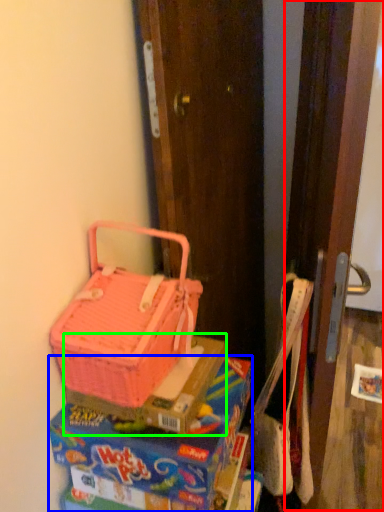
Question: Which object is positioned closest to screen door (highlighted by a red box)? Select from lunch box (highlighted by a blue box) and box (highlighted by a green box).

Choices:
 (A) lunch box
 (B) box

Answer: (A)